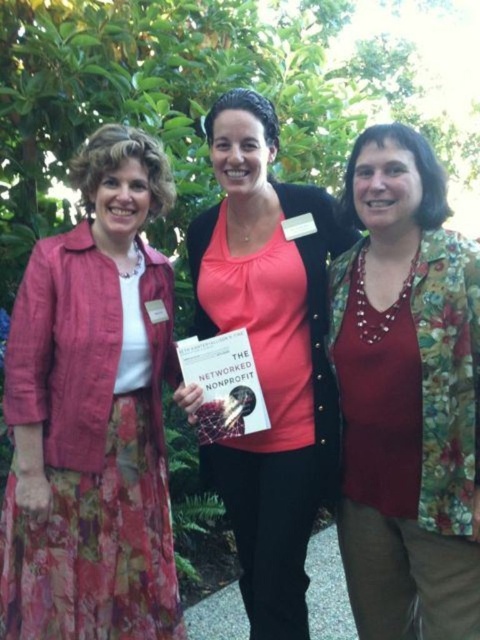
Is matte pink jacket at left further to camera compared to floral fabric blouse at center?

Yes, matte pink jacket at left is further from the viewer.

From the picture: Does matte pink jacket at left come in front of floral fabric blouse at center?

No, it is not.

Describe the element at coordinates (93, 413) in the screenshot. This screenshot has width=480, height=640. I see `matte pink jacket at left` at that location.

The image size is (480, 640). I want to click on matte pink jacket at left, so click(93, 413).

Can you confirm if floral fabric blouse at center is smaller than pink fabric shirt at center?

Correct, floral fabric blouse at center occupies less space than pink fabric shirt at center.

Is point (361, 220) positioned after point (242, 305)?

No.

The height and width of the screenshot is (640, 480). I want to click on floral fabric blouse at center, so click(x=407, y=396).

Which of these two, matte pink jacket at left or pink fabric shirt at center, stands shorter?

Standing shorter between the two is matte pink jacket at left.

Between point (50, 385) and point (333, 211), which one is positioned in front?

Point (50, 385) is more forward.

What do you see at coordinates (93, 413) in the screenshot? The width and height of the screenshot is (480, 640). I see `matte pink jacket at left` at bounding box center [93, 413].

I want to click on matte pink jacket at left, so click(x=93, y=413).